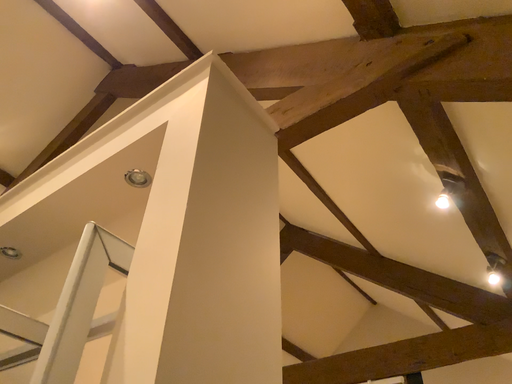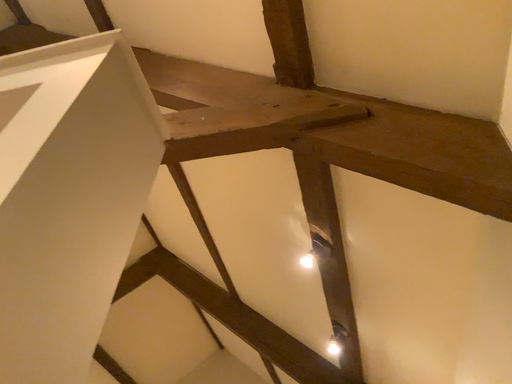
Question: Which way did the camera rotate in the video?

Choices:
 (A) rotated left
 (B) rotated right

Answer: (B)